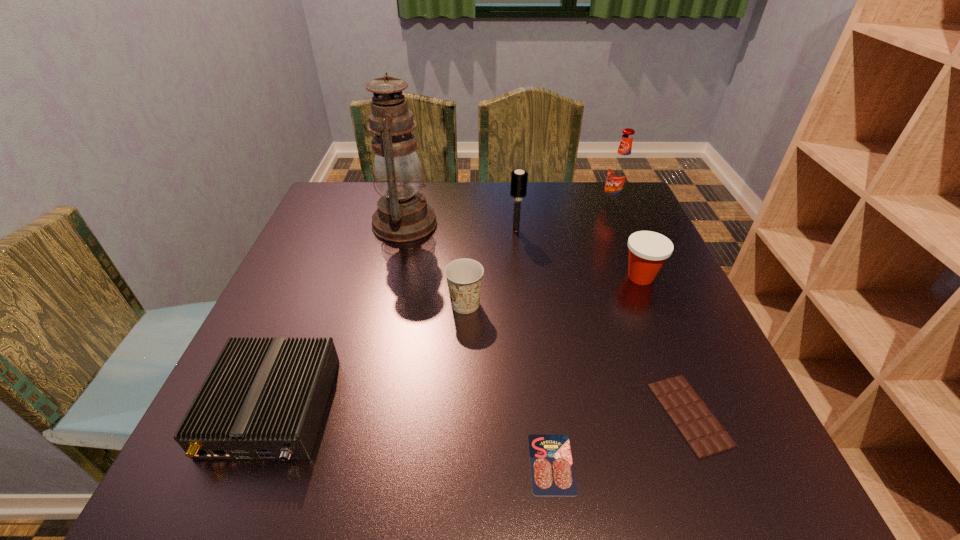
Identify the location of object positioned at the far right corner. (619, 173).

At what (x,y) coordinates should I click in order to perform the action: click on object that is positioned at the near right corner. Please return your answer as a coordinate pair (x, y). Image resolution: width=960 pixels, height=540 pixels. Looking at the image, I should click on (702, 431).

Where is `blank space at the far edge of the desktop`? This screenshot has width=960, height=540. blank space at the far edge of the desktop is located at coordinates (482, 189).

The height and width of the screenshot is (540, 960). I want to click on free location at the left edge of the desktop, so click(278, 307).

I want to click on vacant space at the right edge of the desktop, so click(x=619, y=254).

At what (x,y) coordinates should I click in order to perform the action: click on free space at the far left corner of the desktop. Please return your answer as a coordinate pair (x, y). The width and height of the screenshot is (960, 540). Looking at the image, I should click on pyautogui.click(x=354, y=188).

Image resolution: width=960 pixels, height=540 pixels. I want to click on free point at the far right corner, so click(581, 187).

Locate an element on the screen. Image resolution: width=960 pixels, height=540 pixels. free space between the root beer and the hairbrush is located at coordinates (564, 218).

Where is `vacant point located between the salami and the sixth shortest object`? vacant point located between the salami and the sixth shortest object is located at coordinates (534, 347).

Where is `empty space that is in between the fourth nearest object and the fifth nearest object`? Image resolution: width=960 pixels, height=540 pixels. empty space that is in between the fourth nearest object and the fifth nearest object is located at coordinates (553, 291).